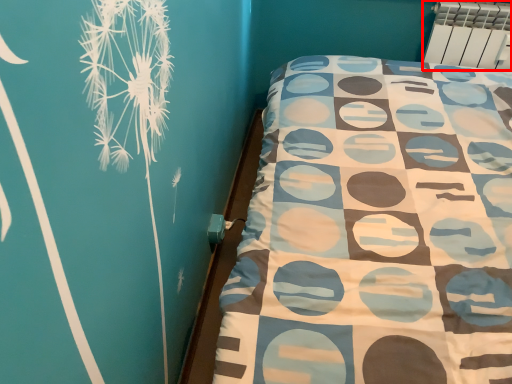
Question: Where is radiator (annotated by the red box) located in relation to bed frame in the image?

Choices:
 (A) left
 (B) right

Answer: (B)